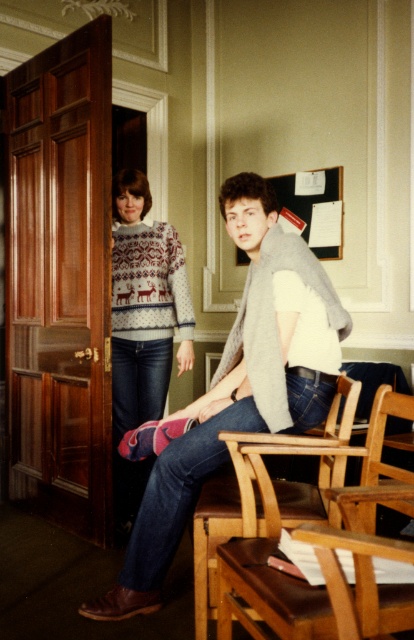
Can you confirm if white knit sweater at center is positioned above white knit sweater with reindeer pattern at left?

Actually, white knit sweater at center is below white knit sweater with reindeer pattern at left.

Is point (149, 432) positioned before point (175, 259)?

Yes, it is in front of point (175, 259).

This screenshot has width=414, height=640. I want to click on white knit sweater at center, so click(x=235, y=387).

Does white knit sweater at center have a lesser height compared to brown leather chair at lower center?

Incorrect, white knit sweater at center's height does not fall short of brown leather chair at lower center's.

How much distance is there between white knit sweater at center and brown leather chair at lower center?

They are 8.99 inches apart.

The image size is (414, 640). I want to click on white knit sweater at center, so click(x=235, y=387).

Identify the location of white knit sweater at center. (235, 387).

Who is lower down, white knit sweater with reindeer pattern at left or brown leather chair at lower center?

brown leather chair at lower center is below.

From the picture: Does white knit sweater with reindeer pattern at left appear over brown leather chair at lower center?

Indeed, white knit sweater with reindeer pattern at left is positioned over brown leather chair at lower center.

I want to click on white knit sweater with reindeer pattern at left, so click(142, 326).

Find the location of a particular element. The width and height of the screenshot is (414, 640). white knit sweater with reindeer pattern at left is located at coordinates (142, 326).